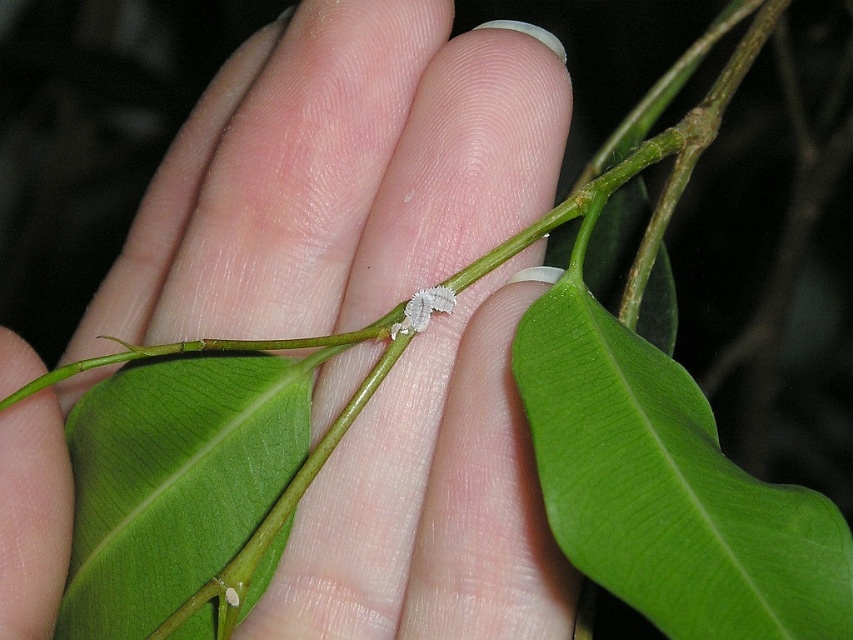
You are a gardener examining a branch with a white matte leaf at center and a white fuzzy caterpillar at center. Which object is positioned lower on the branch?

The white matte leaf at center is positioned below the white fuzzy caterpillar at center, so the leaf is lower on the branch.

You are an artist sketching this scene and want to place a highlight on the white matte leaf at center. According to the image, where should you position the highlight on the leaf?

The highlight should be placed at the 2D coordinates point (x=335, y=176) on the white matte leaf at center as specified in the image description.

Looking at the hand holding the green smooth leaf at center and the white fuzzy caterpillar at center, which object is wider?

The green smooth leaf at center is wider than the white fuzzy caterpillar at center.